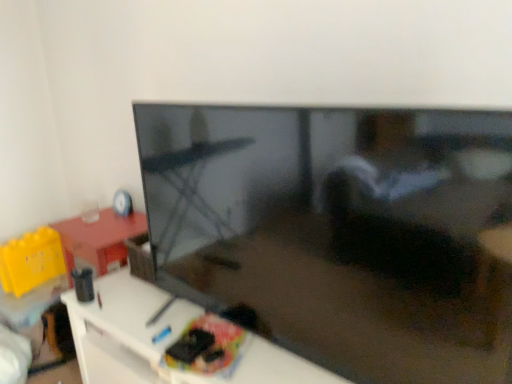
Where is `free space to the left of matte plastic cd at upper left`? free space to the left of matte plastic cd at upper left is located at coordinates (93, 217).